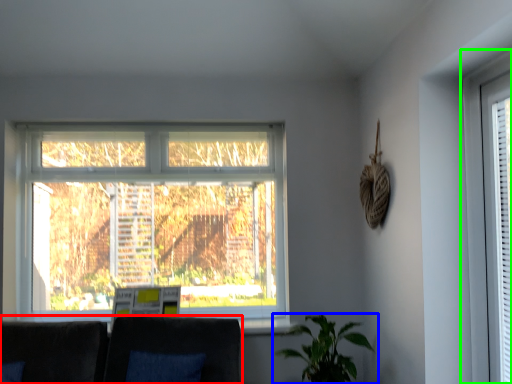
Question: Which object is the farthest from couch (highlighted by a red box)? Choose among these: houseplant (highlighted by a blue box) or window (highlighted by a green box).

Choices:
 (A) houseplant
 (B) window

Answer: (B)